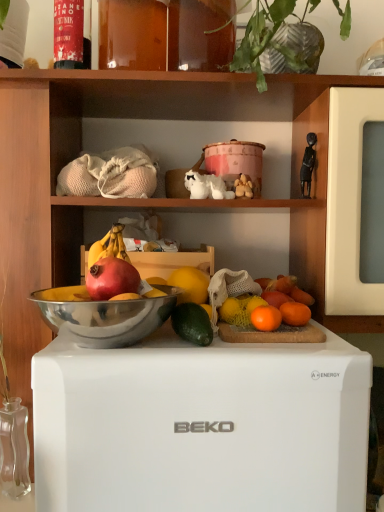
Find the location of `vacant space that's between red matte grapefruit at center, placed as the 3th grapefruit when sorted from back to front, and green matte avocado at center`. vacant space that's between red matte grapefruit at center, placed as the 3th grapefruit when sorted from back to front, and green matte avocado at center is located at coordinates (155, 342).